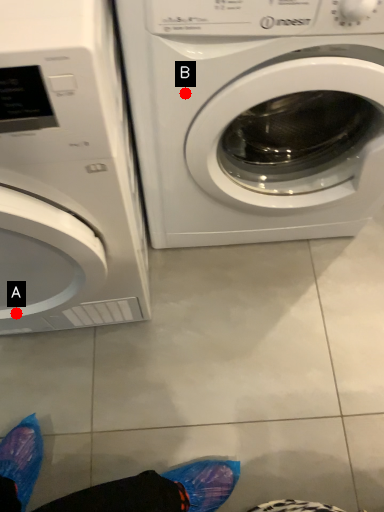
Question: Two points are circled on the image, labeled by A and B beside each circle. Which of the following is the farthest from the observer?

Choices:
 (A) A is further
 (B) B is further

Answer: (A)